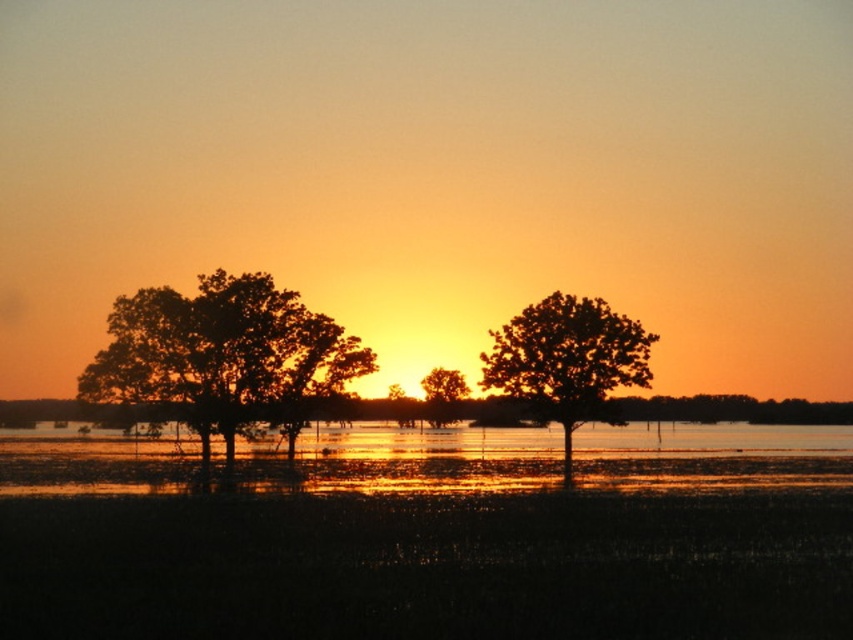
You are standing in the foreground of the sunset scene and want to walk towards the silhouette wood tree at center. Which silhouette tree at left should you pass by first?

You should pass by the silhouette tree at left first because it is closer to you than the silhouette wood tree at center.

Based on the scene description, which tree is positioned to the left when comparing the silhouette tree at left and the green leafy tree at center?

The silhouette tree at left is positioned to the left of the green leafy tree at center.

You are an artist planning to paint the sunset scene. You need to know the relative positions of the silhouette tree at left and the silhouette wood tree at center. Which tree is higher in the image?

The silhouette tree at left is above the silhouette wood tree at center, so it is higher in the image.